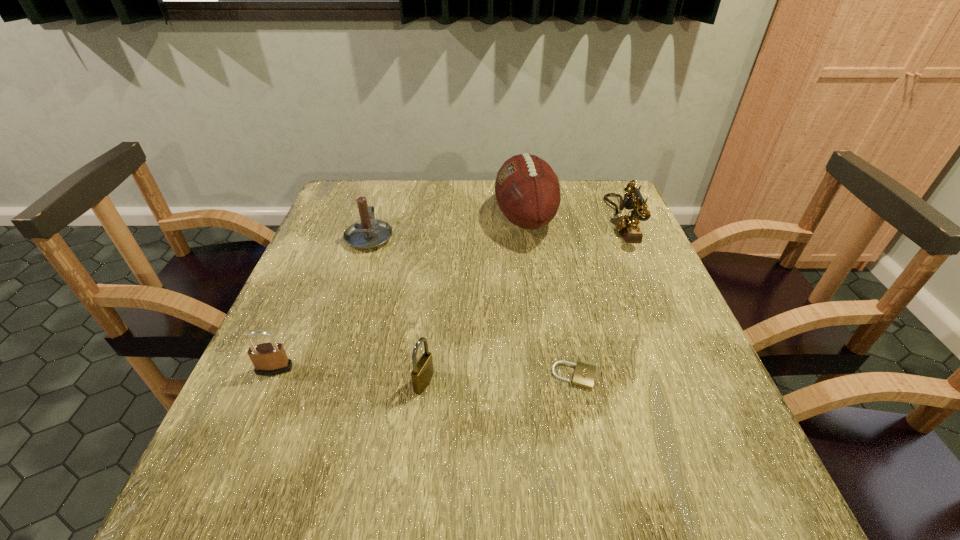
Where is `unoccupied position between the candle and the leftmost padlock`? unoccupied position between the candle and the leftmost padlock is located at coordinates click(x=323, y=303).

Locate an element on the screen. Image resolution: width=960 pixels, height=540 pixels. free space between the second padlock from right to left and the rightmost object is located at coordinates (522, 301).

Find the location of a particular element. free spot between the rightmost object and the second padlock from right to left is located at coordinates (522, 301).

This screenshot has width=960, height=540. In order to click on empty space between the shortest object and the rightmost object in this screenshot , I will do `click(598, 298)`.

You are a GUI agent. You are given a task and a screenshot of the screen. Output one action in this format:
    pyautogui.click(x=<x>, y=<y>)
    Task: Click on the empty location between the candle and the third object from left to right
    The height and width of the screenshot is (540, 960).
    Given the screenshot: What is the action you would take?
    pyautogui.click(x=396, y=309)

Locate an element on the screen. This screenshot has height=540, width=960. vacant space in between the rightmost object and the leftmost object is located at coordinates (447, 294).

Where is `free space between the tallest object and the rightmost padlock`? free space between the tallest object and the rightmost padlock is located at coordinates (550, 297).

The height and width of the screenshot is (540, 960). I want to click on free space between the candle and the second padlock from right to left, so click(x=396, y=309).

Locate which object is the closest to the fourth object from right to left. Please provide its 2D coordinates. Your answer should be formatted as a tuple, i.e. [(x, y)], where the tuple contains the x and y coordinates of a point satisfying the conditions above.

[(584, 375)]

Identify which object is located as the second nearest to the rightmost padlock. Please provide its 2D coordinates. Your answer should be formatted as a tuple, i.e. [(x, y)], where the tuple contains the x and y coordinates of a point satisfying the conditions above.

[(527, 190)]